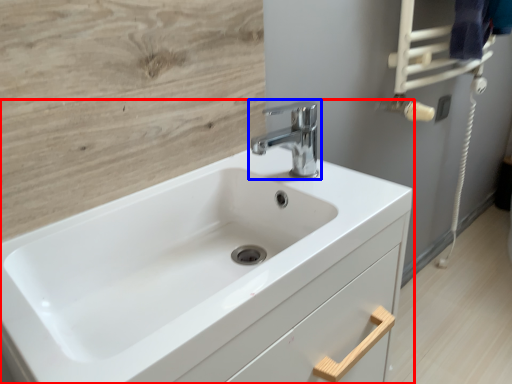
Question: Which object appears closest to the camera in this image, sink (highlighted by a red box) or tap (highlighted by a blue box)?

Choices:
 (A) sink
 (B) tap

Answer: (A)